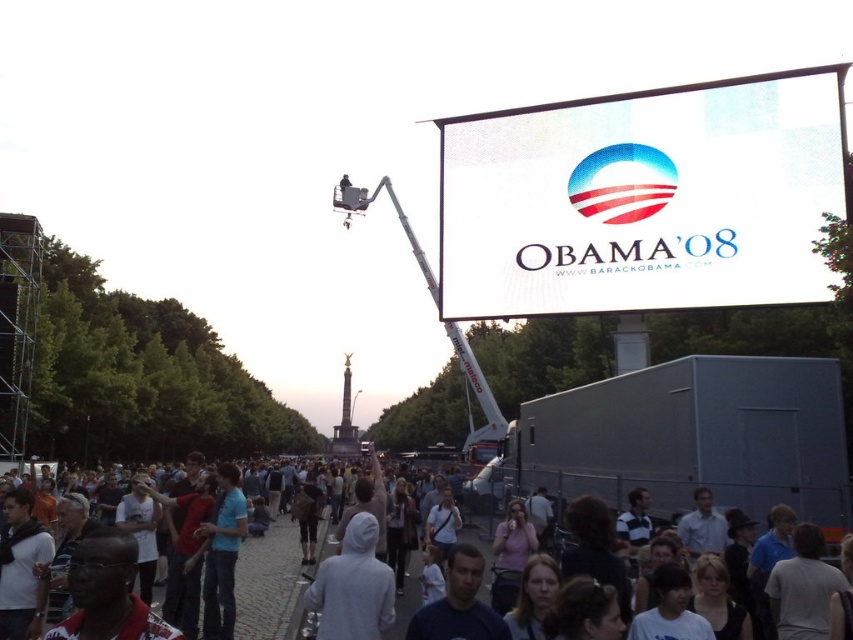
Question: Which point is closer to the camera taking this photo?

Choices:
 (A) (257, 540)
 (B) (573, 144)
 (C) (376, 529)

Answer: (C)

Question: Which of the following is the farthest from the observer?

Choices:
 (A) (318, 627)
 (B) (479, 145)
 (C) (287, 582)

Answer: (C)

Question: Can you confirm if white matte billboard at upper center is positioned above gray hoodie at center?

Choices:
 (A) no
 (B) yes

Answer: (B)

Question: Is white matte billboard at upper center to the left of gray hoodie at center from the viewer's perspective?

Choices:
 (A) no
 (B) yes

Answer: (A)

Question: Which point is closer to the camera?

Choices:
 (A) gray hoodie at center
 (B) white hoodie at center
 (C) white matte billboard at upper center

Answer: (A)

Question: Is white hoodie at center above gray hoodie at center?

Choices:
 (A) no
 (B) yes

Answer: (A)